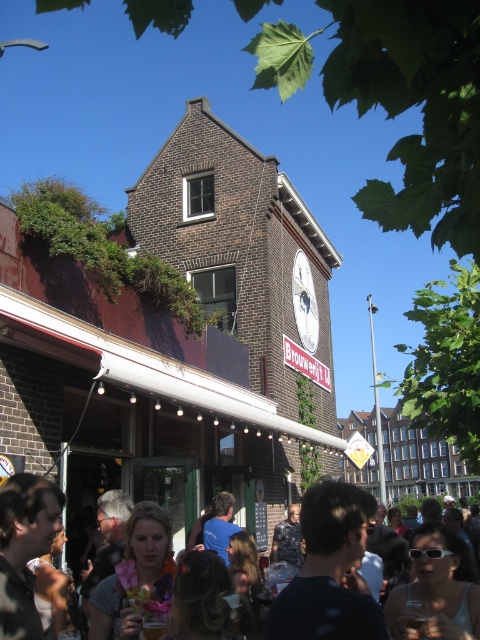
Is matte black hair at center wider than metallic pole at center?

No, matte black hair at center is not wider than metallic pole at center.

At what (x,y) coordinates should I click in order to perform the action: click on matte black hair at center. Please return your answer as a coordinate pair (x, y). This screenshot has width=480, height=640. Looking at the image, I should click on (335, 529).

Which is behind, point (17, 529) or point (372, 384)?

The point (372, 384) is behind.

I want to click on matte black hair at center, so click(x=335, y=529).